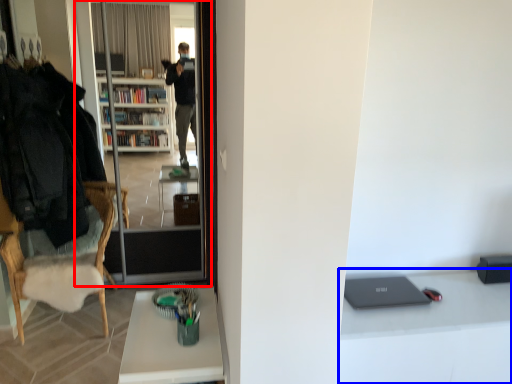
Question: Among these objects, which one is nearest to the camera, screen door (highlighted by a red box) or computer desk (highlighted by a blue box)?

Choices:
 (A) screen door
 (B) computer desk

Answer: (B)